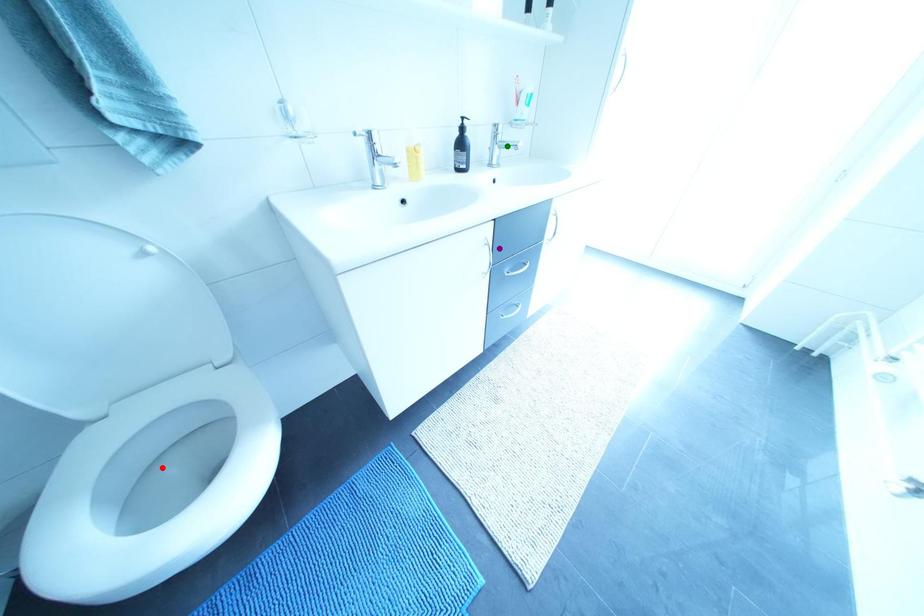
Order these from nearest to farthest:
green point, purple point, red point

red point, purple point, green point